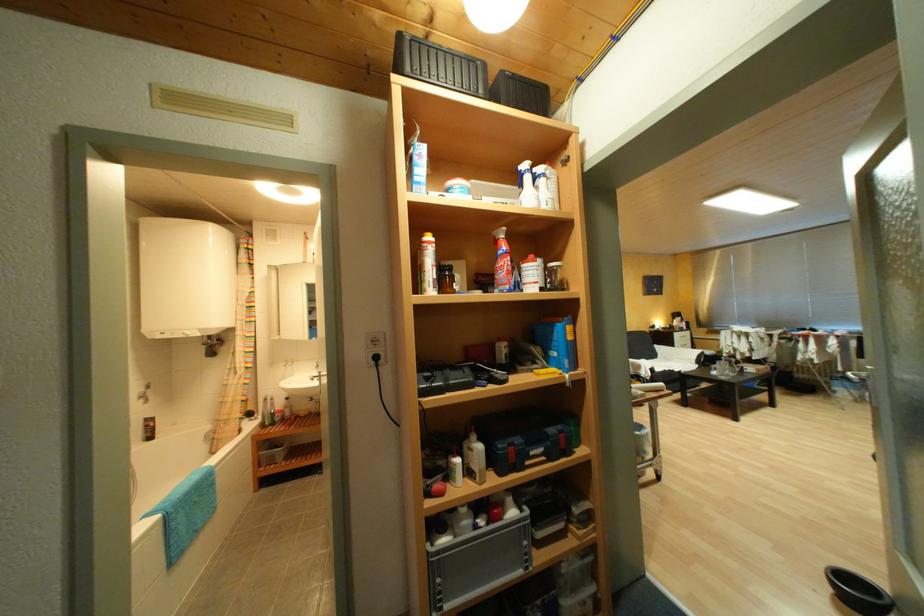
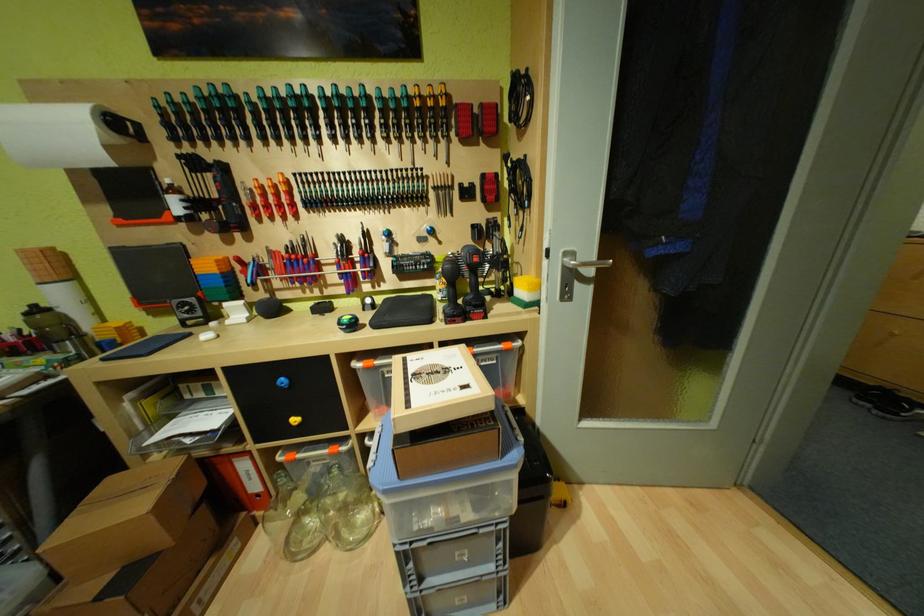
Question: I am providing you with two images of the same scene from different viewpoints. Please identify which objects are invisible in image2.

Choices:
 (A) cordless drill handle
 (B) white wheeled cart
 (C) spray bottle trigger
 (D) paper towel roll

Answer: (C)